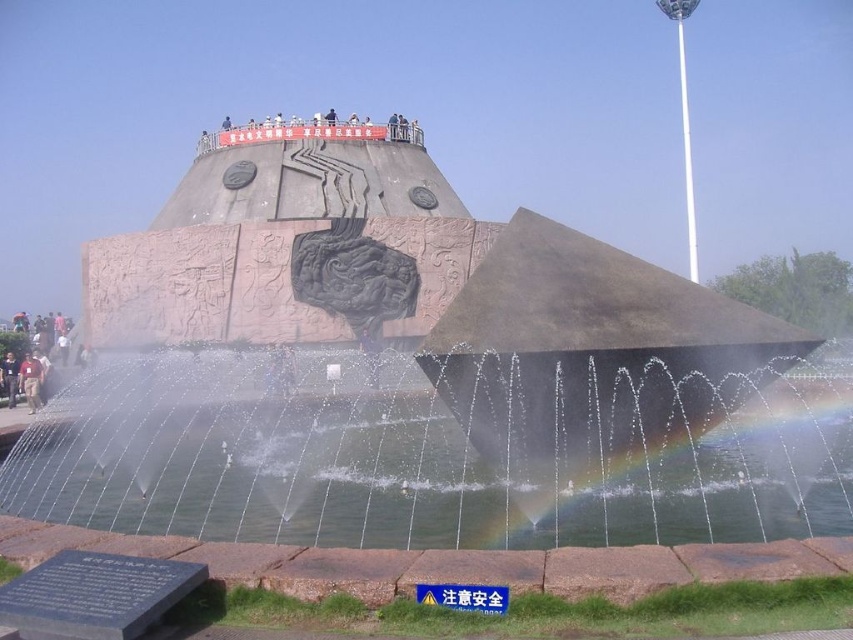
You are standing at the entrance of the monument and want to locate the metallic fountain at center. Based on the coordinates given, in which direction should you move relative to your current position?

The metallic fountain at center is located at coordinates point (416,372). Since the coordinate system is not specified, it is recommended to move towards the central area of the monument to find it.

You are a visitor at the monument and want to take a photo of both the metallic fountain at center and the clear water at fountain center in the same frame. Given that your camera has a maximum focal length that allows capturing objects up to 20 feet apart in the same shot, will you be able to include both objects in one photo?

The metallic fountain at center and clear water at fountain center are 21.55 feet apart from each other. Since the distance exceeds the camera maximum focal length of 20 feet, you won,t be able to capture both in the same frame.

You are a visitor at this monument and want to take a photo of the metallic fountain at center and the clear water at fountain center. Which object should you focus on first if you want to capture both in a single shot without moving your camera?

The metallic fountain at center is taller than the clear water at fountain center, so you should focus on the metallic fountain at center first to ensure both are in frame.